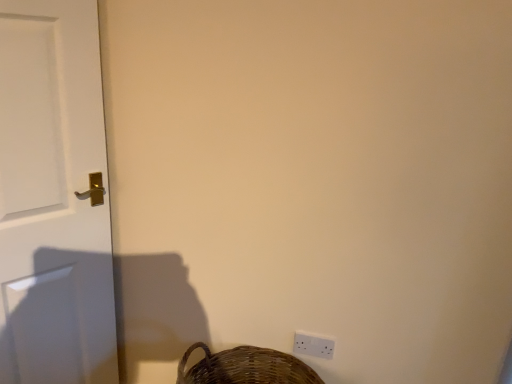
You are a GUI agent. You are given a task and a screenshot of the screen. Output one action in this format:
    pyautogui.click(x=<x>, y=<y>)
    Task: Click on the white glossy door at left
    The height and width of the screenshot is (384, 512).
    Given the screenshot: What is the action you would take?
    pyautogui.click(x=53, y=198)

In order to click on white plastic light switch at lower right in this screenshot , I will do `click(313, 345)`.

The image size is (512, 384). What do you see at coordinates (245, 367) in the screenshot?
I see `brown woven basket at lower right` at bounding box center [245, 367].

Measure the distance between point [192,377] and camera.

The depth of point [192,377] is 5.15 feet.

Image resolution: width=512 pixels, height=384 pixels. In order to click on white glossy door at left in this screenshot , I will do `click(53, 198)`.

From the picture: Between white plastic light switch at lower right and white glossy door at left, which one has larger width?

With larger width is white glossy door at left.

From a real-world perspective, relative to white glossy door at left, is white plastic light switch at lower right vertically above or below?

In terms of real-world spatial position, white plastic light switch at lower right is below white glossy door at left.

In terms of size, does white plastic light switch at lower right appear bigger or smaller than white glossy door at left?

white plastic light switch at lower right is smaller than white glossy door at left.

Can you confirm if white glossy door at left is positioned to the right of brown woven basket at lower right?

No, white glossy door at left is not to the right of brown woven basket at lower right.

Is white glossy door at left bigger or smaller than brown woven basket at lower right?

Considering their sizes, white glossy door at left takes up more space than brown woven basket at lower right.

Would you say white glossy door at left contains brown woven basket at lower right?

Definitely not — brown woven basket at lower right is not inside white glossy door at left.

Are white glossy door at left and brown woven basket at lower right located far from each other?

No, white glossy door at left is in close proximity to brown woven basket at lower right.

From a real-world perspective, who is located higher, brown woven basket at lower right or white glossy door at left?

white glossy door at left is physically above.

Considering the relative sizes of brown woven basket at lower right and white glossy door at left in the image provided, is brown woven basket at lower right wider than white glossy door at left?

Indeed, brown woven basket at lower right has a greater width compared to white glossy door at left.

Which is more to the right, brown woven basket at lower right or white glossy door at left?

From the viewer's perspective, brown woven basket at lower right appears more on the right side.

Could white glossy door at left be considered to be inside brown woven basket at lower right?

No.

Is point (17, 142) closer to camera compared to point (329, 343)?

Yes, point (17, 142) is in front of point (329, 343).

Considering the positions of objects white glossy door at left and white plastic light switch at lower right in the image provided, who is more to the right, white glossy door at left or white plastic light switch at lower right?

white plastic light switch at lower right.

From a real-world perspective, is white glossy door at left above or below white plastic light switch at lower right?

white glossy door at left is above white plastic light switch at lower right.

Between white glossy door at left and white plastic light switch at lower right, which one has smaller size?

white plastic light switch at lower right is smaller.

From the picture: Is brown woven basket at lower right touching white plastic light switch at lower right?

brown woven basket at lower right and white plastic light switch at lower right are clearly separated.

How much distance is there between brown woven basket at lower right and white plastic light switch at lower right?

7.48 inches.

Can you confirm if brown woven basket at lower right is thinner than white plastic light switch at lower right?

Incorrect, the width of brown woven basket at lower right is not less than that of white plastic light switch at lower right.

From a real-world perspective, is brown woven basket at lower right physically located above or below white plastic light switch at lower right?

brown woven basket at lower right is below white plastic light switch at lower right.

Is white plastic light switch at lower right smaller than brown woven basket at lower right?

Yes, white plastic light switch at lower right is smaller than brown woven basket at lower right.

Is white plastic light switch at lower right positioned far away from brown woven basket at lower right?

No, white plastic light switch at lower right is in close proximity to brown woven basket at lower right.

Would you say white plastic light switch at lower right is to the left or to the right of brown woven basket at lower right in the picture?

In the image, white plastic light switch at lower right appears on the right side of brown woven basket at lower right.

From the image's perspective, is white plastic light switch at lower right below brown woven basket at lower right?

No, from the image's perspective, white plastic light switch at lower right is not beneath brown woven basket at lower right.

You are a GUI agent. You are given a task and a screenshot of the screen. Output one action in this format:
    pyautogui.click(x=<x>, y=<y>)
    Task: Click on the door in front of the white plastic light switch at lower right
    The width and height of the screenshot is (512, 384).
    Given the screenshot: What is the action you would take?
    pyautogui.click(x=53, y=198)

Identify the location of door that is on the left side of brown woven basket at lower right. This screenshot has height=384, width=512. (53, 198).

Consider the image. Which object lies nearer to the anchor point white plastic light switch at lower right, brown woven basket at lower right or white glossy door at left?

brown woven basket at lower right.

From the image, which object appears to be nearer to brown woven basket at lower right, white glossy door at left or white plastic light switch at lower right?

The object closer to brown woven basket at lower right is white plastic light switch at lower right.

Based on their spatial positions, is white plastic light switch at lower right or brown woven basket at lower right closer to white glossy door at left?

Based on the image, brown woven basket at lower right appears to be nearer to white glossy door at left.

Considering their positions, is white glossy door at left positioned closer to white plastic light switch at lower right than brown woven basket at lower right?

Based on the image, brown woven basket at lower right appears to be nearer to white plastic light switch at lower right.

Considering their positions, is white plastic light switch at lower right positioned further to brown woven basket at lower right than white glossy door at left?

white glossy door at left.

Which object lies nearer to the anchor point white glossy door at left, brown woven basket at lower right or white plastic light switch at lower right?

brown woven basket at lower right lies closer to white glossy door at left than the other object.

Where is `basket located between white glossy door at left and white plastic light switch at lower right in the left-right direction`? This screenshot has height=384, width=512. basket located between white glossy door at left and white plastic light switch at lower right in the left-right direction is located at coordinates (245, 367).